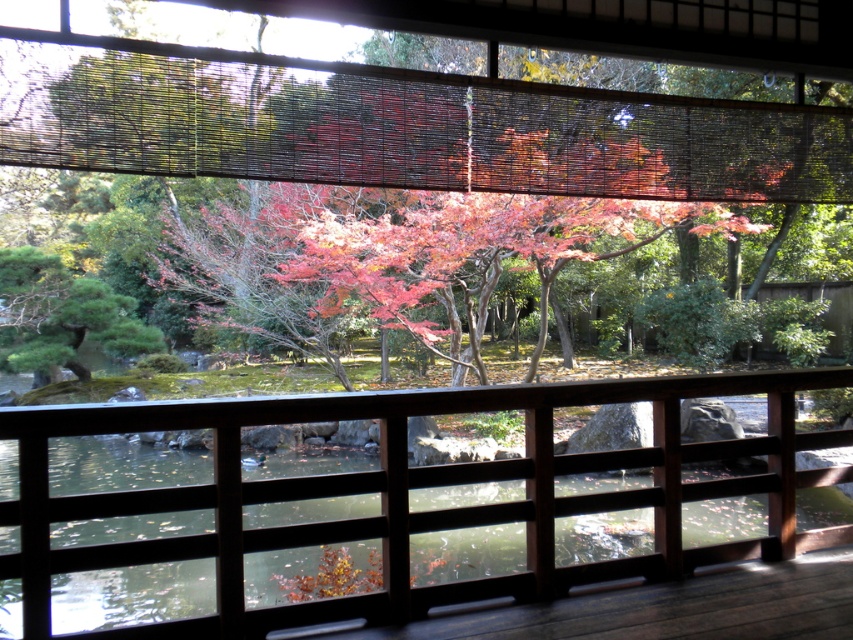
Based on the photo, which is below, autumn leaves at center or brown wooden rail at center?

brown wooden rail at center is below.

This screenshot has width=853, height=640. I want to click on autumn leaves at center, so click(421, 129).

What do you see at coordinates (421, 129) in the screenshot? I see `autumn leaves at center` at bounding box center [421, 129].

I want to click on autumn leaves at center, so click(x=421, y=129).